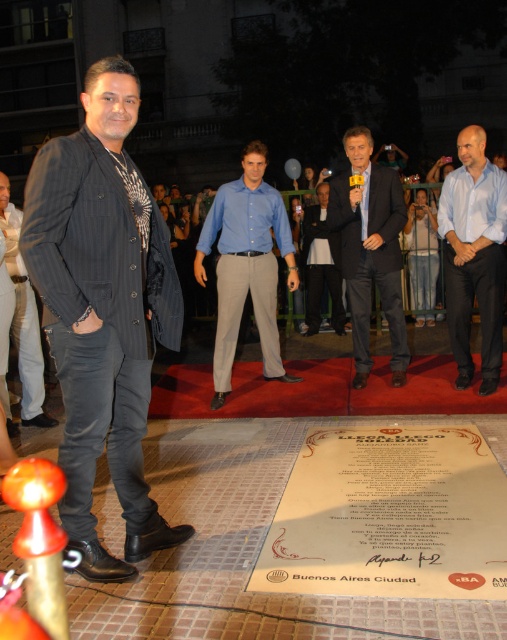
Question: Can you confirm if blue smooth shirt at center is thinner than matte black jacket at center?

Choices:
 (A) yes
 (B) no

Answer: (B)

Question: Among these points, which one is farthest from the camera?

Choices:
 (A) (61, 515)
 (B) (312, 314)
 (C) (266, 266)

Answer: (B)

Question: Which object is closer to the camera taking this photo?

Choices:
 (A) matte black jacket at center
 (B) blue cotton shirt at center
 (C) blue smooth shirt at center
 (D) dark gray wool suit at center

Answer: (A)

Question: Which object is the farthest from the dark pinstripe suit at left?

Choices:
 (A) blue cotton shirt at center
 (B) blue smooth shirt at center

Answer: (B)

Question: Can you confirm if blue smooth shirt at center is positioned above matte black jacket at center?

Choices:
 (A) no
 (B) yes

Answer: (B)

Question: Can you confirm if matte black jacket at center is positioned below dark gray wool suit at center?

Choices:
 (A) no
 (B) yes

Answer: (B)